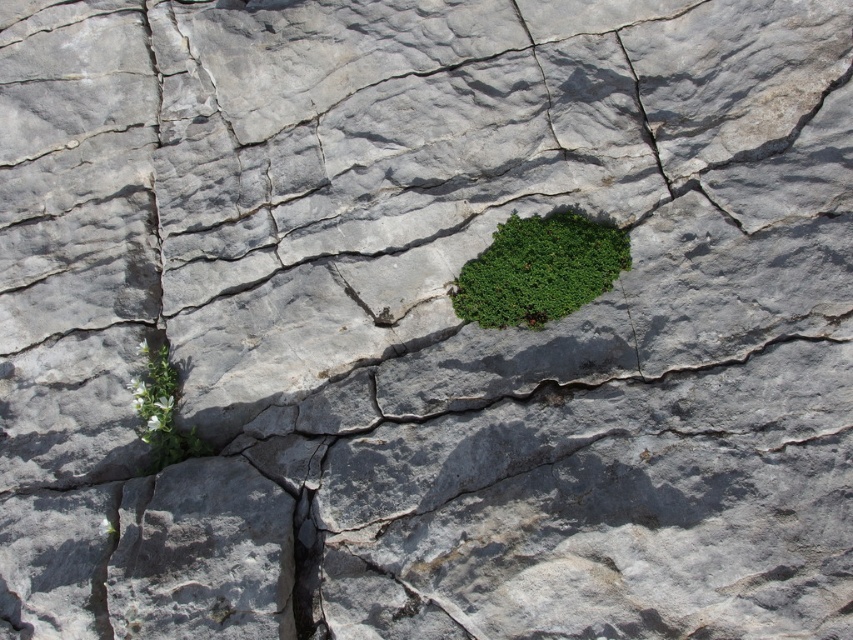
Between green leafy plant at center and green leafy plant at lower left, which one has less height?

green leafy plant at center is shorter.

Between green leafy plant at center and green leafy plant at lower left, which one is positioned higher?

green leafy plant at center is higher up.

Between point (619, 241) and point (171, 432), which one is positioned behind?

Positioned behind is point (171, 432).

This screenshot has height=640, width=853. What are the coordinates of `green leafy plant at center` in the screenshot? It's located at (538, 269).

How much distance is there between green leafy plant at center and smooth dark gray rock at bottom center?

5.65 feet

Who is positioned more to the left, green leafy plant at center or smooth dark gray rock at bottom center?

smooth dark gray rock at bottom center is more to the left.

Who is more forward, (610, 273) or (302, 499)?

Positioned in front is point (302, 499).

You are a GUI agent. You are given a task and a screenshot of the screen. Output one action in this format:
    pyautogui.click(x=<x>, y=<y>)
    Task: Click on the green leafy plant at center
    This screenshot has width=853, height=640.
    Given the screenshot: What is the action you would take?
    pyautogui.click(x=538, y=269)

Can you confirm if green leafy plant at lower left is shorter than smooth dark gray rock at bottom center?

In fact, green leafy plant at lower left may be taller than smooth dark gray rock at bottom center.

Is green leafy plant at lower left thinner than smooth dark gray rock at bottom center?

In fact, green leafy plant at lower left might be wider than smooth dark gray rock at bottom center.

Where is `green leafy plant at lower left`? The image size is (853, 640). green leafy plant at lower left is located at coordinates (161, 410).